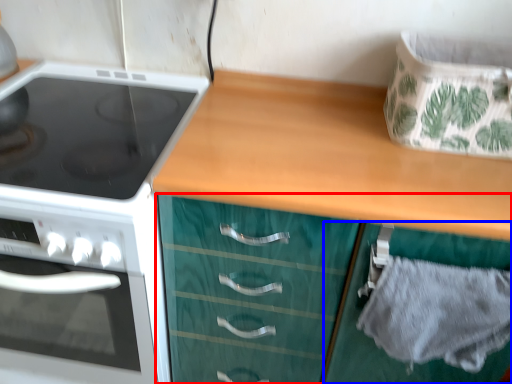
Question: Among these objects, which one is farthest to the camera, cabinetry (highlighted by a red box) or cabinetry (highlighted by a blue box)?

Choices:
 (A) cabinetry
 (B) cabinetry

Answer: (B)